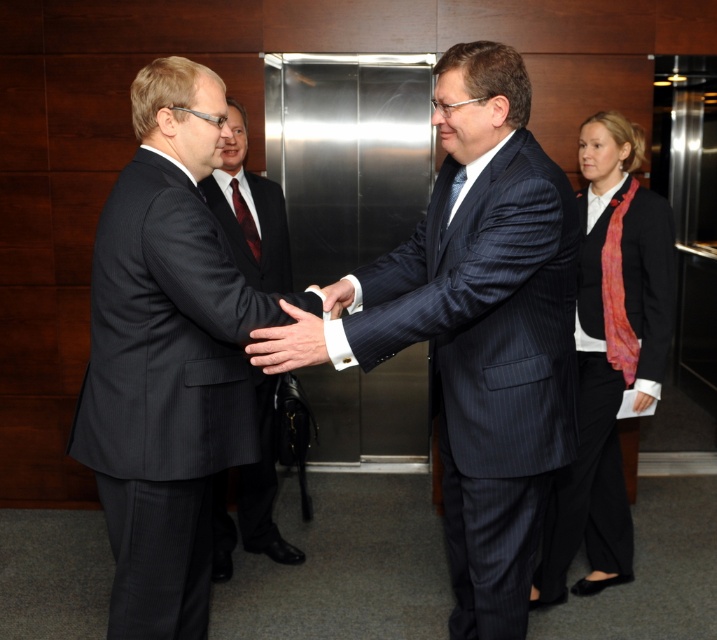
Which is more to the right, white smooth hand at center or white glossy cufflink at center?

From the viewer's perspective, white glossy cufflink at center appears more on the right side.

Which is in front, point (303, 310) or point (351, 292)?

Point (303, 310) is more forward.

Who is more distant from viewer, (308,364) or (336,292)?

The point (336,292) is more distant.

In order to click on white smooth hand at center in this screenshot , I will do `click(288, 342)`.

Consider the image. Can you confirm if pinstriped wool suit at center is positioned to the right of shiny red tie at center?

Yes, pinstriped wool suit at center is to the right of shiny red tie at center.

Is point (260, 426) in front of point (247, 225)?

No, it is not.

Is point (250, 502) farther from camera compared to point (251, 228)?

Yes.

In order to click on pinstriped wool suit at center in this screenshot , I will do `click(255, 230)`.

Is point (136, 83) positioned before point (607, 525)?

Yes, it is.

Is point (80, 432) farther from viewer compared to point (594, 449)?

No, it is not.

Where is `dark gray pinstripe suit at center`? The image size is (717, 640). dark gray pinstripe suit at center is located at coordinates (166, 356).